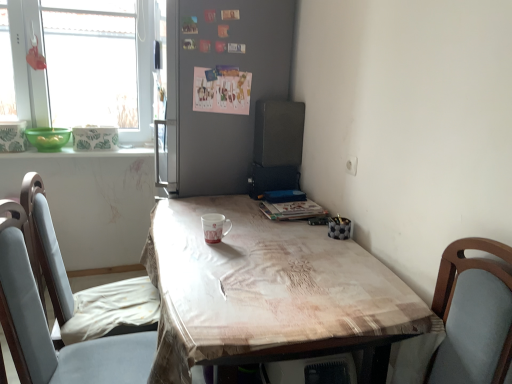
Where is `vacant region to the right of white glossy mug at center`? vacant region to the right of white glossy mug at center is located at coordinates (259, 244).